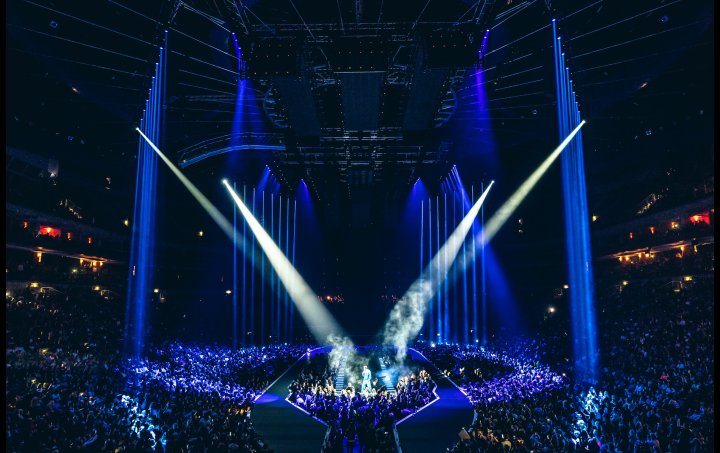
At what (x,y) coordinates should I click in order to perform the action: click on purple light circle. Please return your answer as a coordinate pair (x, y). Image resolution: width=720 pixels, height=453 pixels. Looking at the image, I should click on (189, 383), (377, 402), (482, 397), (546, 375), (271, 357), (444, 346).